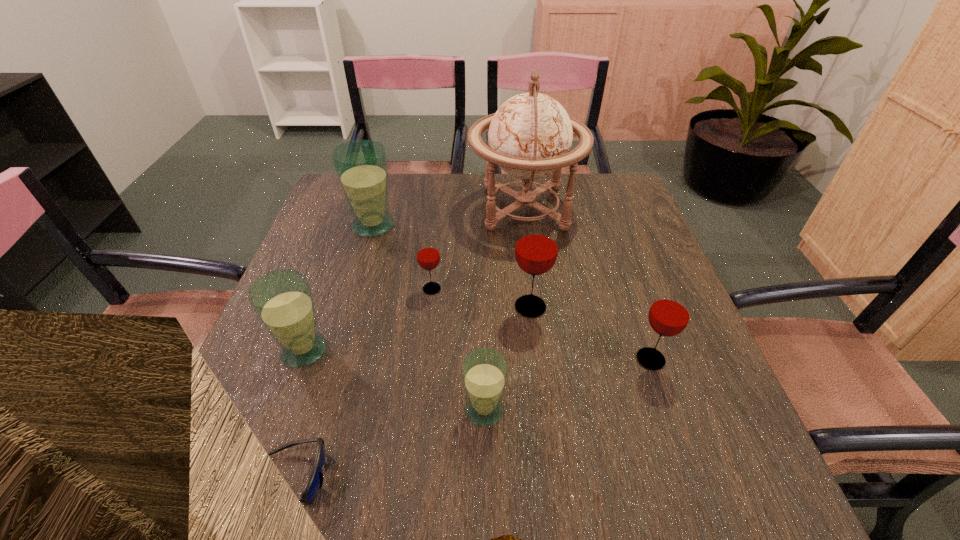
Where is `free spot between the second red glass from right to left and the fifth object from right to left`? The image size is (960, 540). free spot between the second red glass from right to left and the fifth object from right to left is located at coordinates (481, 298).

Find the location of a particular element. free area in between the biggest red glass and the biggest blue glass is located at coordinates (452, 266).

Where is `vacant area between the second nearest object and the farthest glass`? The image size is (960, 540). vacant area between the second nearest object and the farthest glass is located at coordinates (429, 318).

This screenshot has width=960, height=540. I want to click on vacant region between the rightmost object and the leftmost red glass, so click(541, 324).

Find the location of `free space between the farthest blue glass and the fourth glass from right to left`. free space between the farthest blue glass and the fourth glass from right to left is located at coordinates 402,257.

The width and height of the screenshot is (960, 540). Identify the location of free space that is in between the biggest red glass and the farthest blue glass. (452, 266).

The height and width of the screenshot is (540, 960). I want to click on vacant space in between the rightmost blue glass and the shortest object, so click(386, 444).

Where is `object that ranks as the third closest to the second nearest blue glass`? The width and height of the screenshot is (960, 540). object that ranks as the third closest to the second nearest blue glass is located at coordinates (484, 372).

Identify which object is the nearest to the rightmost blue glass. Please provide its 2D coordinates. Your answer should be formatted as a tuple, i.e. [(x, y)], where the tuple contains the x and y coordinates of a point satisfying the conditions above.

[(536, 249)]

Where is `glass that is the fifth closest one to the nearest red glass`? This screenshot has width=960, height=540. glass that is the fifth closest one to the nearest red glass is located at coordinates (361, 166).